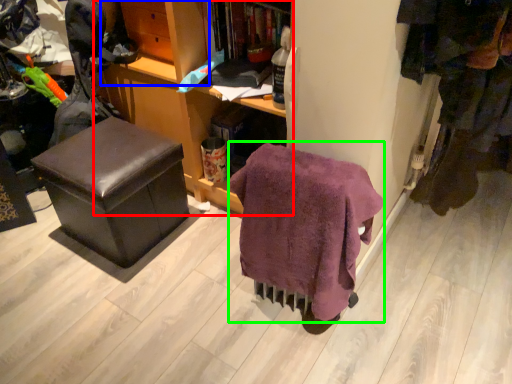
Question: Which object is positioned closest to cabinetry (highlighted by a red box)? Select from shelf (highlighted by a blue box) and blanket (highlighted by a green box).

Choices:
 (A) shelf
 (B) blanket

Answer: (A)